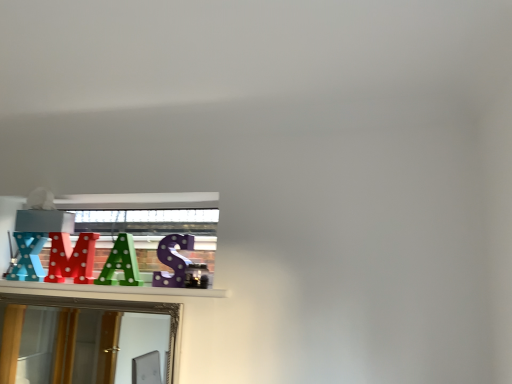
The image size is (512, 384). What do you see at coordinates (121, 263) in the screenshot?
I see `green polka dot letter at center` at bounding box center [121, 263].

In order to click on green polka dot letter at center in this screenshot , I will do `click(121, 263)`.

This screenshot has width=512, height=384. Describe the element at coordinates (66, 345) in the screenshot. I see `gold-framed mirror at lower left` at that location.

The image size is (512, 384). Identify the location of gold-framed mirror at lower left. (66, 345).

This screenshot has height=384, width=512. I want to click on green polka dot letter at center, so click(121, 263).

Considering the positions of objects green polka dot letter at center and gold-framed mirror at lower left in the image provided, who is more to the right, green polka dot letter at center or gold-framed mirror at lower left?

Positioned to the right is green polka dot letter at center.

Who is more distant, green polka dot letter at center or gold-framed mirror at lower left?

green polka dot letter at center is further from the camera.

Which is less distant, (98, 284) or (19, 351)?

Point (98, 284).

From the image's perspective, is green polka dot letter at center on top of gold-framed mirror at lower left?

Yes, from the image's perspective, green polka dot letter at center is above gold-framed mirror at lower left.

From a real-world perspective, which object rests below the other?

In real-world perspective, gold-framed mirror at lower left is lower.

Which object is wider, green polka dot letter at center or gold-framed mirror at lower left?

Wider between the two is gold-framed mirror at lower left.

Between green polka dot letter at center and gold-framed mirror at lower left, which one has more height?

gold-framed mirror at lower left.

Between green polka dot letter at center and gold-framed mirror at lower left, which one has smaller size?

Smaller between the two is green polka dot letter at center.

Based on the photo, would you say gold-framed mirror at lower left is part of green polka dot letter at center's contents?

No, gold-framed mirror at lower left is located outside of green polka dot letter at center.

Is green polka dot letter at center positioned far away from gold-framed mirror at lower left?

green polka dot letter at center is far away from gold-framed mirror at lower left.

Is green polka dot letter at center facing away from gold-framed mirror at lower left?

No.

Consider the image. What's the angular difference between green polka dot letter at center and gold-framed mirror at lower left's facing directions?

green polka dot letter at center and gold-framed mirror at lower left are facing 0.405 degrees away from each other.

Looking at this image, measure the distance from green polka dot letter at center to gold-framed mirror at lower left.

7.16 feet.

The image size is (512, 384). Identify the location of alphabet that appears above the gold-framed mirror at lower left (from a real-world perspective). (121, 263).

Which object is positioned more to the right, gold-framed mirror at lower left or green polka dot letter at center?

From the viewer's perspective, green polka dot letter at center appears more on the right side.

Which is behind, gold-framed mirror at lower left or green polka dot letter at center?

green polka dot letter at center is behind.

Considering the points (66, 358) and (119, 256), which point is behind, point (66, 358) or point (119, 256)?

Point (66, 358)

From the image's perspective, does gold-framed mirror at lower left appear lower than green polka dot letter at center?

Yes, from the image's perspective, gold-framed mirror at lower left is below green polka dot letter at center.

From a real-world perspective, is gold-framed mirror at lower left located higher than green polka dot letter at center?

No, from a real-world perspective, gold-framed mirror at lower left is not on top of green polka dot letter at center.

Does gold-framed mirror at lower left have a lesser width compared to green polka dot letter at center?

No.

Considering the sizes of gold-framed mirror at lower left and green polka dot letter at center in the image, is gold-framed mirror at lower left taller or shorter than green polka dot letter at center?

gold-framed mirror at lower left is taller than green polka dot letter at center.

Does gold-framed mirror at lower left have a smaller size compared to green polka dot letter at center?

No, gold-framed mirror at lower left is not smaller than green polka dot letter at center.

In the scene shown: Is gold-framed mirror at lower left inside or outside of green polka dot letter at center?

gold-framed mirror at lower left lies outside green polka dot letter at center.

Is gold-framed mirror at lower left far from green polka dot letter at center?

Yes, gold-framed mirror at lower left is far from green polka dot letter at center.

Could you tell me if gold-framed mirror at lower left is facing green polka dot letter at center?

No, gold-framed mirror at lower left is not facing towards green polka dot letter at center.

What's the angular difference between gold-framed mirror at lower left and green polka dot letter at center's facing directions?

The facing directions of gold-framed mirror at lower left and green polka dot letter at center are 0.405 degrees apart.

How far apart are gold-framed mirror at lower left and green polka dot letter at center?

gold-framed mirror at lower left and green polka dot letter at center are 7.16 feet apart from each other.

Identify the location of mirror below the green polka dot letter at center (from a real-world perspective). The width and height of the screenshot is (512, 384). (66, 345).

Identify the location of mirror in front of the green polka dot letter at center. (66, 345).

Identify the location of alphabet above the gold-framed mirror at lower left (from the image's perspective). (121, 263).